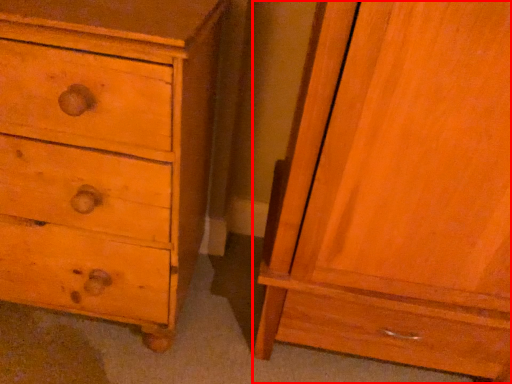
Question: Where is nightstand (annotated by the red box) located in relation to chest of drawers in the image?

Choices:
 (A) right
 (B) left

Answer: (A)